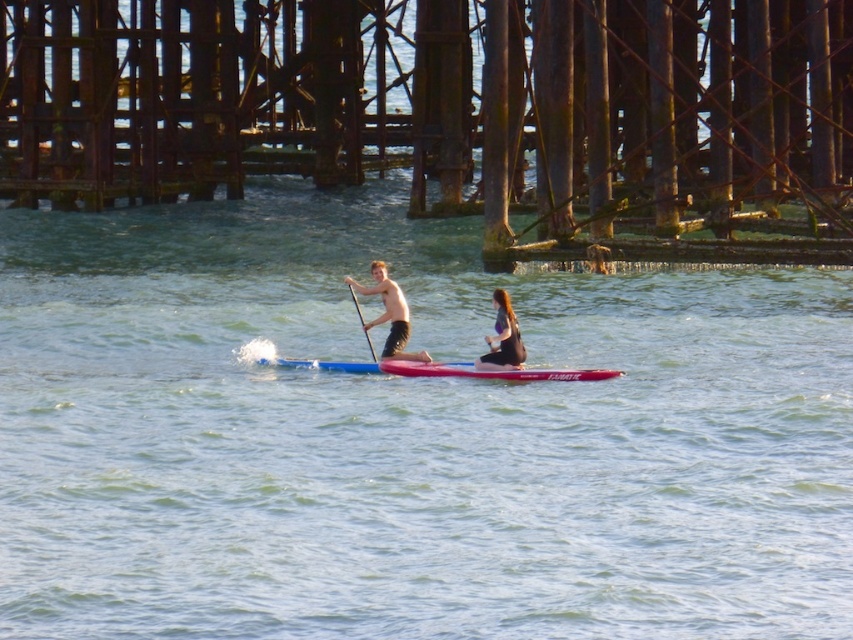
Question: Which object appears farthest from the camera in this image?

Choices:
 (A) clear blue water at center
 (B) matte black wetsuit at center

Answer: (B)

Question: Is clear blue water at center smaller than shiny black paddleboard at center?

Choices:
 (A) no
 (B) yes

Answer: (A)

Question: Which is nearer to the matte black wetsuit at center?

Choices:
 (A) clear blue water at center
 (B) smooth white paddle at center

Answer: (B)

Question: Does clear blue water at center have a lesser width compared to smooth white paddle at center?

Choices:
 (A) yes
 (B) no

Answer: (B)

Question: Considering the relative positions of shiny black paddleboard at center and smooth white paddle at center in the image provided, where is shiny black paddleboard at center located with respect to smooth white paddle at center?

Choices:
 (A) above
 (B) below

Answer: (B)

Question: Which point is closer to the camera taking this photo?

Choices:
 (A) (380, 260)
 (B) (503, 305)
 (C) (802, 602)
 (D) (363, 326)

Answer: (C)